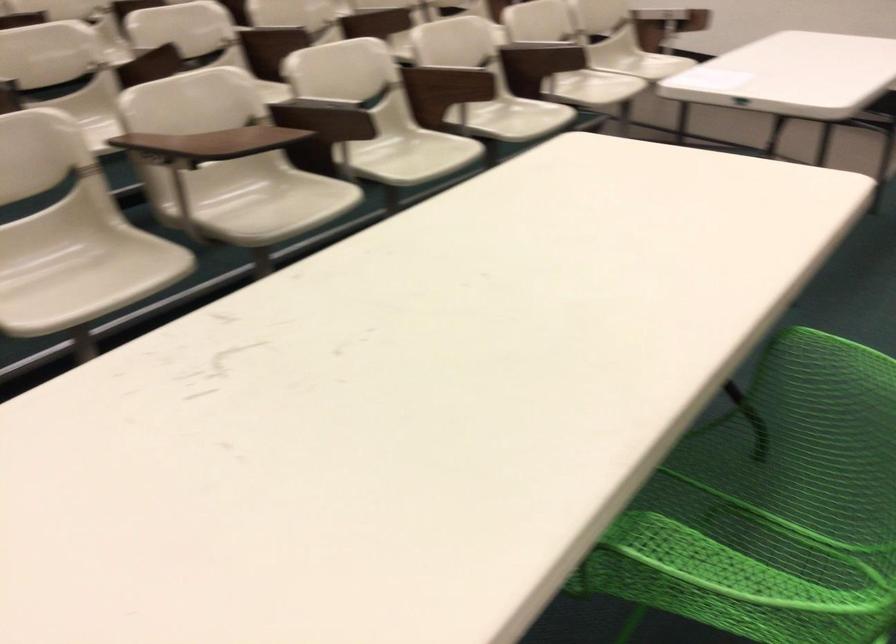
What do you see at coordinates (760, 527) in the screenshot?
I see `a green chair sitting surface` at bounding box center [760, 527].